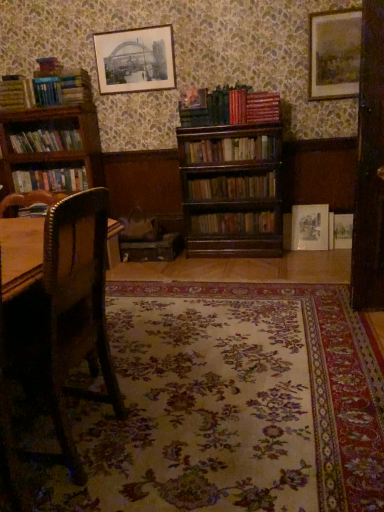
Locate an element on the screen. This screenshot has height=512, width=384. free point above wooden picture frame at upper right, acting as the third picture frame starting from the left (from a real-world perspective) is located at coordinates (336, 6).